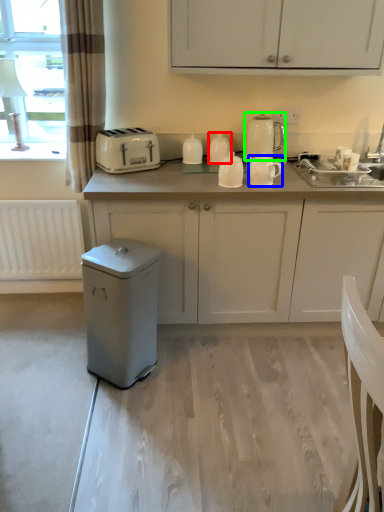
Question: Which is nearer to the kitchen appliance (highlighted by a red box)? kitchen appliance (highlighted by a blue box) or kitchen appliance (highlighted by a green box).

Choices:
 (A) kitchen appliance
 (B) kitchen appliance

Answer: (B)